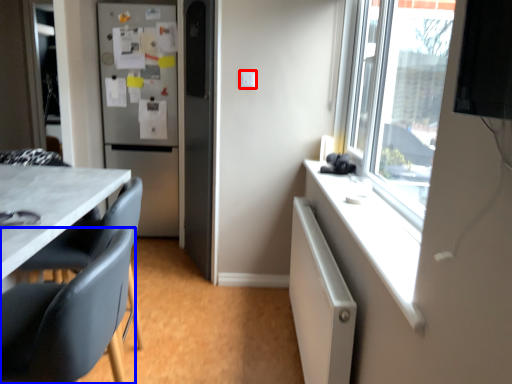
Question: Which object is closer to the camera taking this photo, electric outlet (highlighted by a red box) or chair (highlighted by a blue box)?

Choices:
 (A) electric outlet
 (B) chair

Answer: (B)